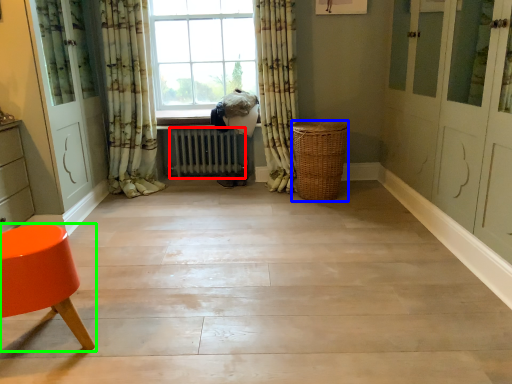
Question: Based on their relative distances, which object is farther from radiator (highlighted by a red box)? Choose from basket (highlighted by a blue box) and chair (highlighted by a green box).

Choices:
 (A) basket
 (B) chair

Answer: (B)